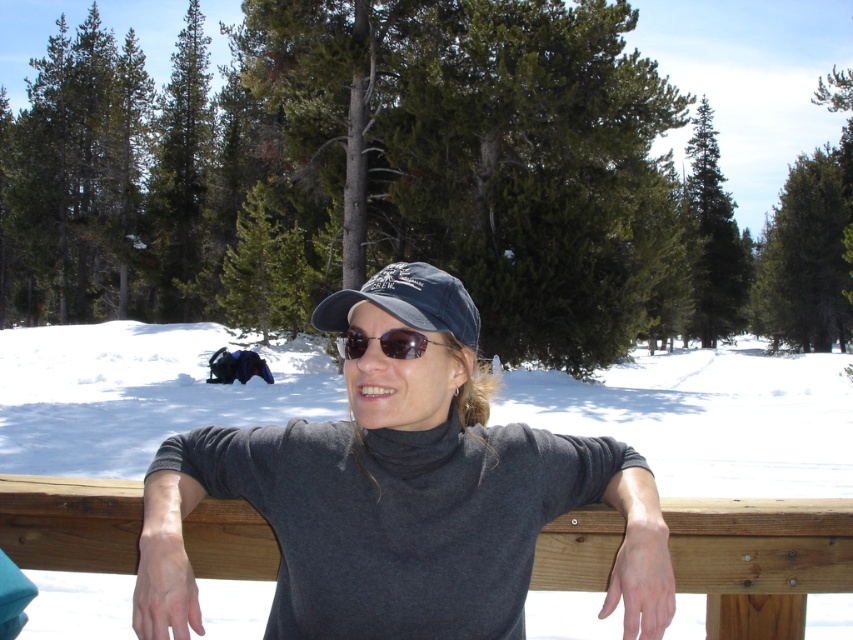
You are a photographer trying to capture the person in the scene. If you focus on the sunglasses at center, will the brown wooden rail at center appear in front of them in the photo?

Yes, the brown wooden rail at center appears in front of the sunglasses at center because the sunglasses at center is behind the brown wooden rail at center.

You are a photographer trying to capture the person in the scene. If you want to focus on the gray matte turtleneck at center without the dark blue fabric cap at center blocking it, where should you position your camera?

Position the camera so that it captures the gray matte turtleneck at center from an angle where the dark blue fabric cap at center is not in front of it. Since the gray matte turtleneck is in front of the dark blue fabric cap, adjusting the camera angle slightly downward or sideways would ensure the turtleneck remains in focus without obstruction.

You are a photographer trying to capture the person in the snowy environment. You want to ensure both the gray matte turtleneck at center and the dark blue fabric cap at center are clearly visible in your photo. Given their sizes, which one might you need to adjust your focus on more carefully to ensure clarity?

The gray matte turtleneck at center is larger in size than the dark blue fabric cap at center, so you might need to focus more carefully on the dark blue fabric cap at center to ensure it remains clear in the photo.